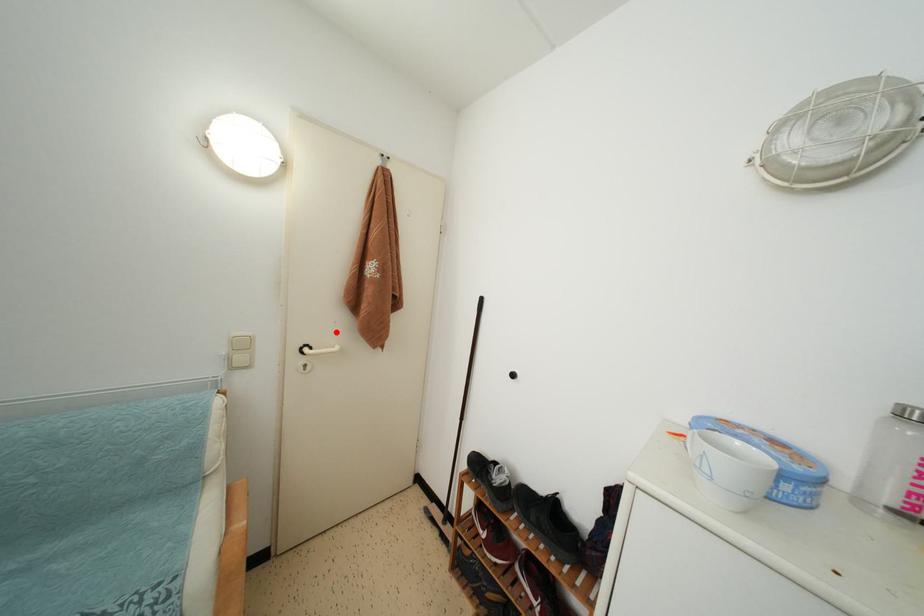
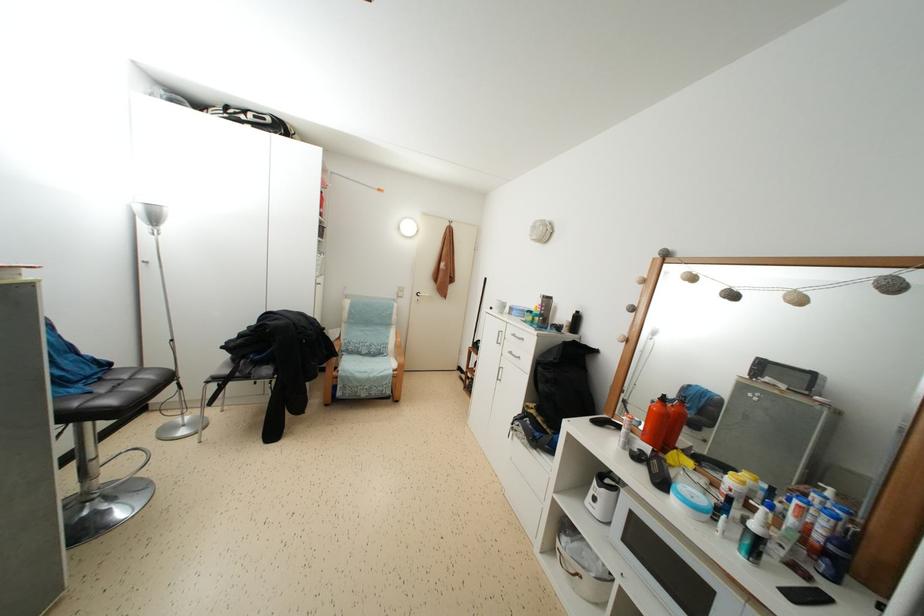
Where in the second image is the point corresponding to the highlighted location from the first image?

(432, 293)